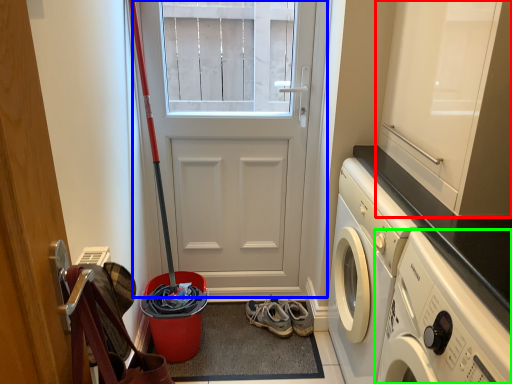
Question: Estimate the real-world distances between objects in this image. Which object is farther from cabinetry (highlighted by a red box), door (highlighted by a blue box) or washing machine (highlighted by a green box)?

Choices:
 (A) door
 (B) washing machine

Answer: (A)